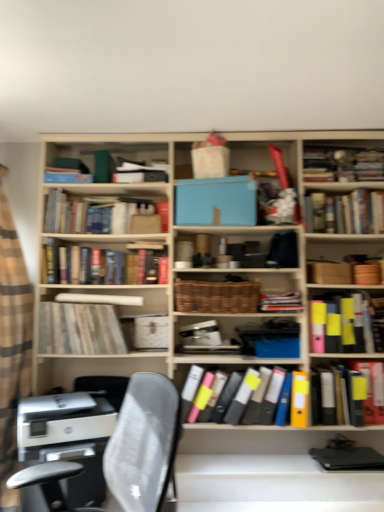
Question: From the image's perspective, is blue matte book at center above or below hardcover books at center, which is the 3th book from top to bottom?

Choices:
 (A) above
 (B) below

Answer: (A)

Question: Does point (226, 216) appear closer or farther from the camera than point (165, 266)?

Choices:
 (A) farther
 (B) closer

Answer: (B)

Question: Which object is positioned farthest from the hardcover book at upper right, which is the seventh book from bottom to top?

Choices:
 (A) multicolored file folders at center, positioned as the first book in bottom-to-top order
 (B) matte black folder at right, which is the 7th book from top to bottom
 (C) blue matte book at center
 (D) matte black book at center, which is the fourth book from top to bottom
 (E) woven brown basket at center

Answer: (A)

Question: Estimate the real-world distances between objects in this image. Which object is closer to the woven brown basket at center?

Choices:
 (A) matte yellow folder at right, the fifth book in the top-to-bottom sequence
 (B) matte black book at center, which is the fourth book from top to bottom
 (C) hardcover books at upper left, placed as the 1th book when sorted from top to bottom
 (D) blue matte book at center
 (E) hardcover book at upper right, which appears as the 2th book when viewed from the top

Answer: (B)